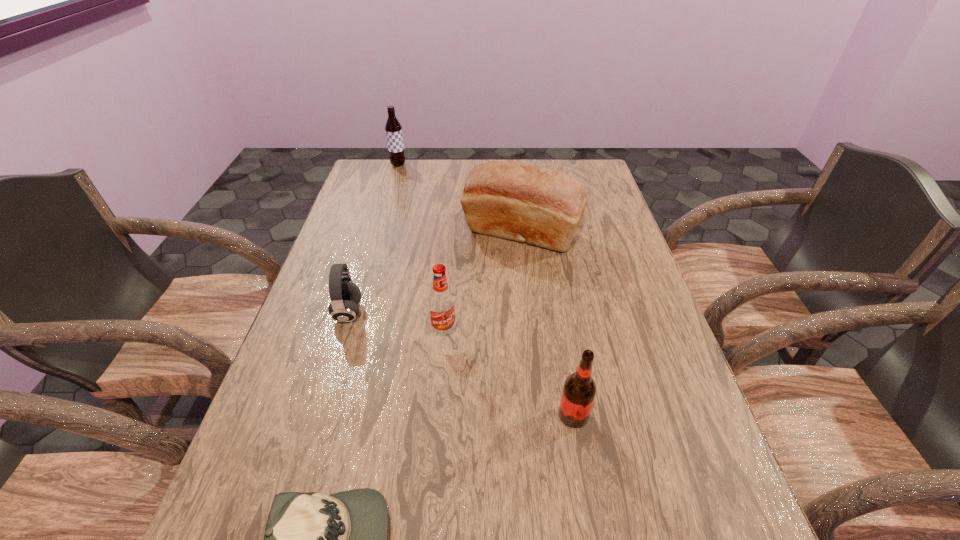
Where is `the farthest root beer`? Image resolution: width=960 pixels, height=540 pixels. the farthest root beer is located at coordinates (393, 128).

I want to click on the farthest object, so click(x=393, y=128).

At what (x,y) coordinates should I click in order to perform the action: click on the second farthest object. Please return your answer as a coordinate pair (x, y). The width and height of the screenshot is (960, 540). Looking at the image, I should click on (522, 202).

What are the coordinates of `the second root beer from right to left` in the screenshot? It's located at pos(442,309).

Locate an element on the screen. the second farthest root beer is located at coordinates (442, 309).

At what (x,y) coordinates should I click in order to perform the action: click on the nearest root beer. Please return your answer as a coordinate pair (x, y). The image size is (960, 540). Looking at the image, I should click on (579, 390).

This screenshot has height=540, width=960. I want to click on the fifth farthest object, so click(579, 390).

Where is `headset`? The width and height of the screenshot is (960, 540). headset is located at coordinates (345, 295).

Identify the location of blank space located on the left of the farthest object. (373, 165).

You are a GUI agent. You are given a task and a screenshot of the screen. Output one action in this format:
    pyautogui.click(x=<x>, y=<y>)
    Task: Click on the free space located on the back of the bread
    This screenshot has width=960, height=540.
    Given the screenshot: What is the action you would take?
    pyautogui.click(x=514, y=167)